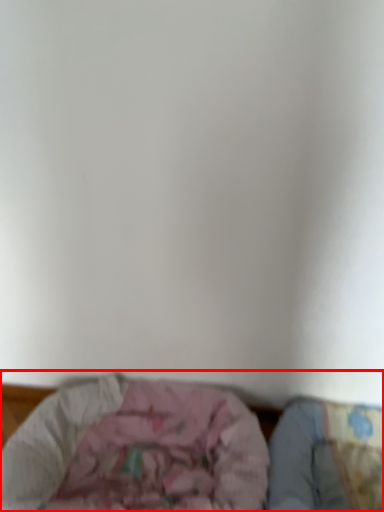
Question: From the image's perspective, where is furniture (annotated by the red box) located relative to sheet?

Choices:
 (A) above
 (B) below

Answer: (A)